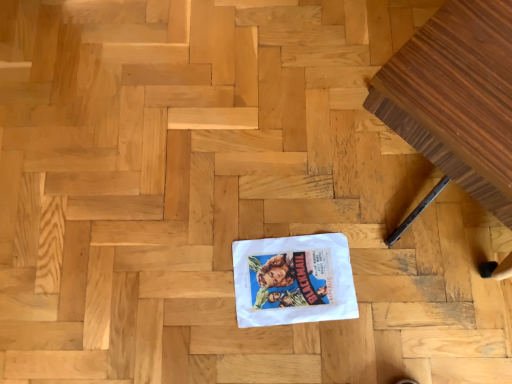
What is the approximate width of wooden piano at right?

wooden piano at right is 28.34 inches wide.

Locate an element on the screen. wooden piano at right is located at coordinates (457, 97).

What is the approximate height of wooden piano at right?

It is 64.16 centimeters.

Describe the element at coordinates (457, 97) in the screenshot. I see `wooden piano at right` at that location.

The image size is (512, 384). I want to click on wooden piano at right, so click(x=457, y=97).